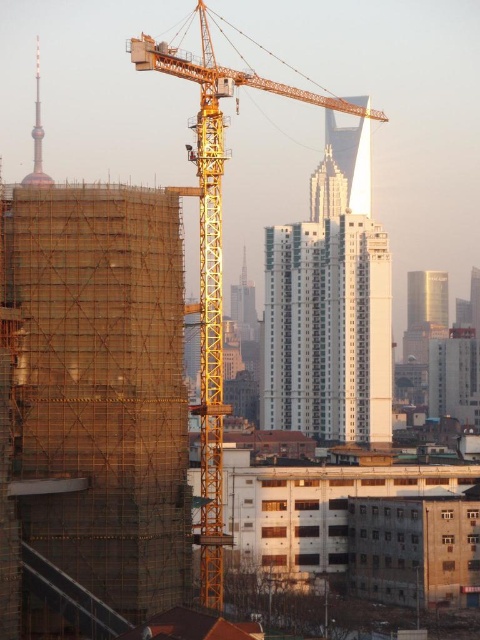
Can you confirm if yellow metallic crane at center is wider than shiny gold tower at upper left?

Correct, the width of yellow metallic crane at center exceeds that of shiny gold tower at upper left.

Does yellow metallic crane at center appear on the left side of shiny gold tower at upper left?

In fact, yellow metallic crane at center is to the right of shiny gold tower at upper left.

Does point (203, 598) come closer to viewer compared to point (39, 138)?

Yes, point (203, 598) is in front of point (39, 138).

Locate an element on the screen. This screenshot has height=640, width=480. yellow metallic crane at center is located at coordinates [216, 253].

I want to click on yellow metallic crane at center, so click(x=216, y=253).

Is yellow metallic crane at center shorter than gold reflective tower at right?

No.

Where is `yellow metallic crane at center`? Image resolution: width=480 pixels, height=640 pixels. yellow metallic crane at center is located at coordinates (216, 253).

Can you confirm if white smooth building at center is smaller than gold reflective tower at right?

No, white smooth building at center is not smaller than gold reflective tower at right.

Which is in front, point (277, 355) or point (420, 310)?

Point (277, 355)

Which is in front, point (348, 317) or point (430, 282)?

Point (348, 317)

Identify the location of white smooth building at center. The width and height of the screenshot is (480, 640). (330, 305).